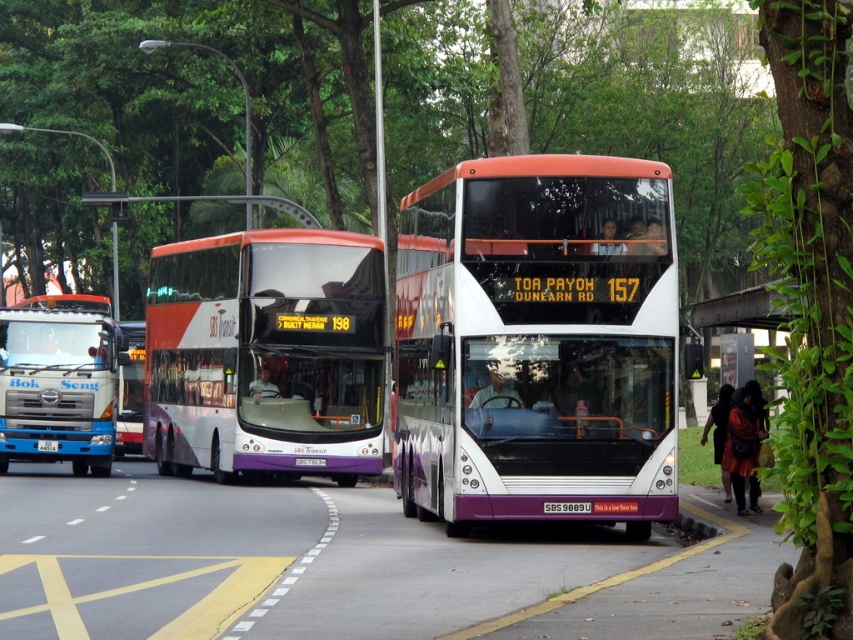
Which is above, purple plastic license plate at center or black plastic license plate at center?

Positioned higher is purple plastic license plate at center.

I want to click on purple plastic license plate at center, so click(566, 508).

You are a GUI agent. You are given a task and a screenshot of the screen. Output one action in this format:
    pyautogui.click(x=<x>, y=<y>)
    Task: Click on the purple plastic license plate at center
    Image resolution: width=853 pixels, height=640 pixels.
    Given the screenshot: What is the action you would take?
    pyautogui.click(x=566, y=508)

Which is above, metallic silver bus stop at right or black plastic license plate at center?

metallic silver bus stop at right

Between metallic silver bus stop at right and black plastic license plate at center, which one has less height?

Standing shorter between the two is black plastic license plate at center.

Does point (776, 342) come in front of point (44, 442)?

No.

Locate an element on the screen. metallic silver bus stop at right is located at coordinates (740, 330).

Is blue metallic truck at left taller than metallic silver bus stop at right?

Indeed, blue metallic truck at left has a greater height compared to metallic silver bus stop at right.

Can you confirm if blue metallic truck at left is smaller than metallic silver bus stop at right?

Indeed, blue metallic truck at left has a smaller size compared to metallic silver bus stop at right.

Describe the element at coordinates (59, 380) in the screenshot. The height and width of the screenshot is (640, 853). I see `blue metallic truck at left` at that location.

Find the location of a particular element. blue metallic truck at left is located at coordinates (59, 380).